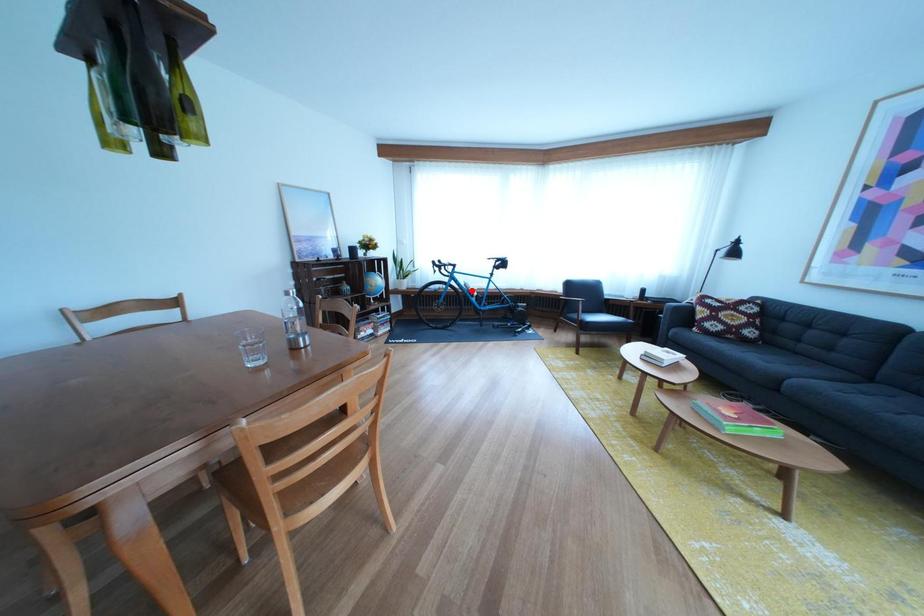
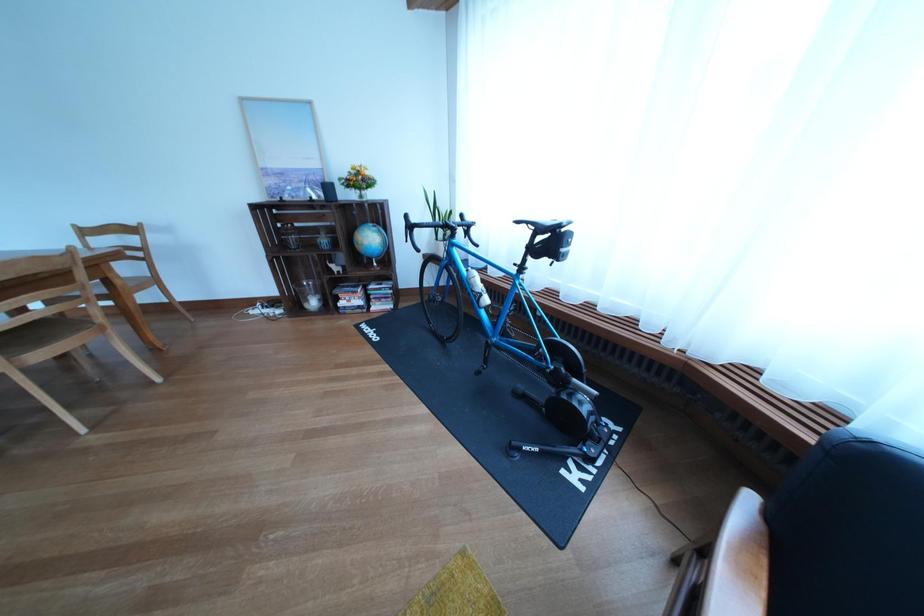
Where in the second image is the point corresponding to the highlighted location from the first image?

(470, 277)